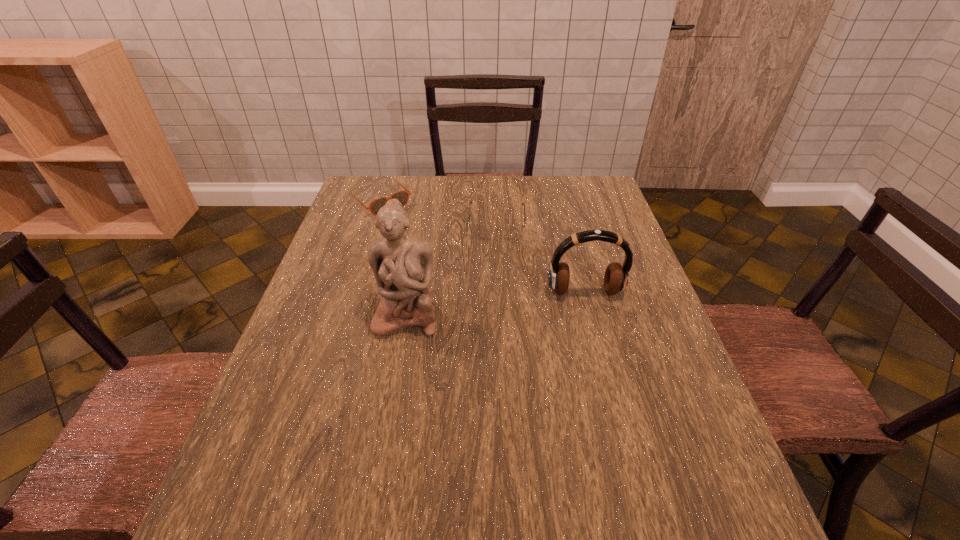
Identify the location of free space on the desktop that is between the figurine and the second tallest object and is positioned on the front-facing side of the spectacles. (496, 303).

Where is `free space on the desktop that is between the figurine and the second tallest object and is positioned on the front-facing side of the sunglasses`? free space on the desktop that is between the figurine and the second tallest object and is positioned on the front-facing side of the sunglasses is located at coordinates (492, 305).